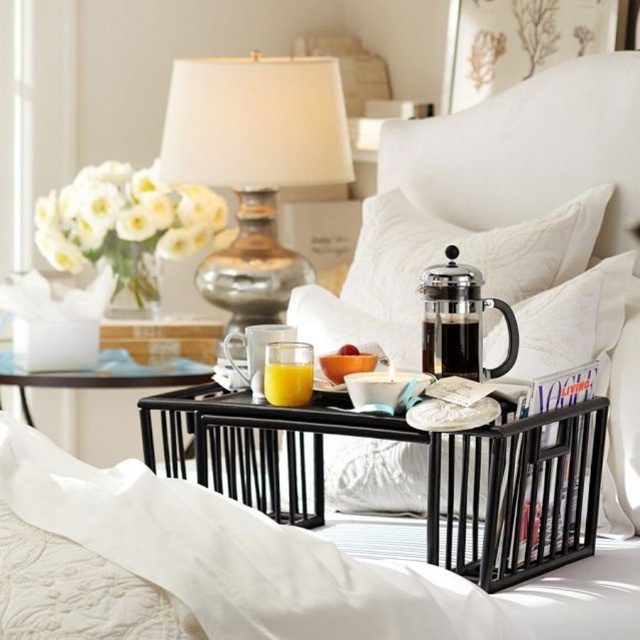
Is satin white pillow at center smaller than orange matte/porcelain bowl at center?

No.

Does satin white pillow at center have a lesser height compared to orange matte/porcelain bowl at center?

No.

Between point (365, 237) and point (355, 348), which one is positioned behind?

The point (365, 237) is more distant.

Locate an element on the screen. satin white pillow at center is located at coordinates (465, 252).

Who is lower down, translucent glass at center or smooth orange bowl at center?

translucent glass at center

Can you confirm if translucent glass at center is positioned above smooth orange bowl at center?

No, translucent glass at center is not above smooth orange bowl at center.

This screenshot has height=640, width=640. What do you see at coordinates (288, 381) in the screenshot?
I see `translucent glass at center` at bounding box center [288, 381].

The height and width of the screenshot is (640, 640). I want to click on translucent glass at center, so click(288, 381).

Between black metal tray at center and satin white pillow at center, which one has less height?

black metal tray at center is shorter.

Find the location of a particular element. The height and width of the screenshot is (640, 640). black metal tray at center is located at coordinates (428, 472).